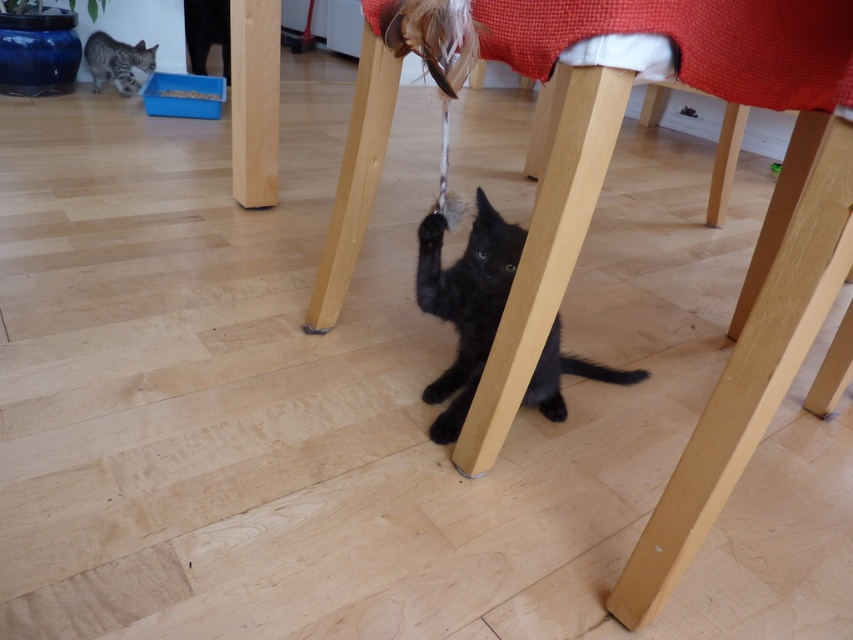
Question: Among these objects, which one is farthest from the camera?

Choices:
 (A) wooden chair at center
 (B) black matte fur cat at lower center

Answer: (B)

Question: Which object is positioned farthest from the red woven cloth at upper center?

Choices:
 (A) black matte fur cat at lower center
 (B) striped fur cat at lower left
 (C) wooden chair at center

Answer: (B)

Question: Where is wooden chair at center located in relation to striped fur cat at lower left in the image?

Choices:
 (A) below
 (B) above

Answer: (A)

Question: Which point is farther to the camera?

Choices:
 (A) striped fur cat at lower left
 (B) red woven cloth at upper center

Answer: (A)

Question: Is red woven cloth at upper center below black matte fur cat at lower center?

Choices:
 (A) yes
 (B) no

Answer: (B)

Question: Can you confirm if wooden chair at center is smaller than black matte fur cat at lower center?

Choices:
 (A) no
 (B) yes

Answer: (A)